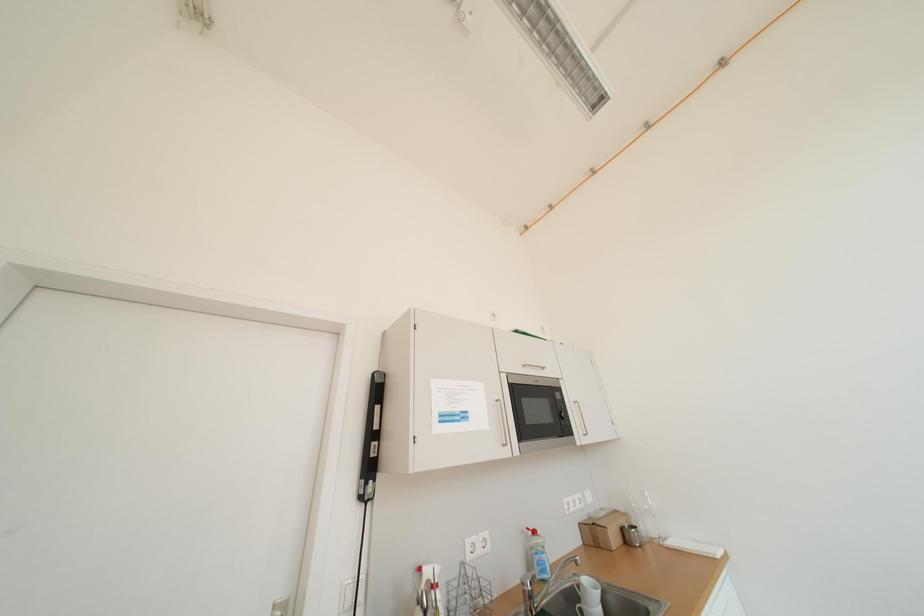
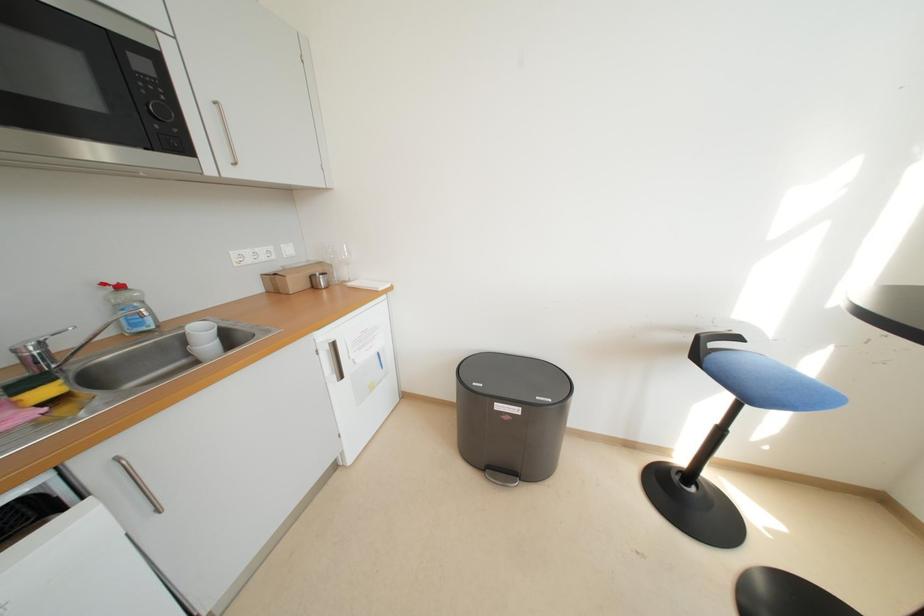
Based on the continuous images, in which direction is the camera rotating?

The rotation direction of the camera is right-down.